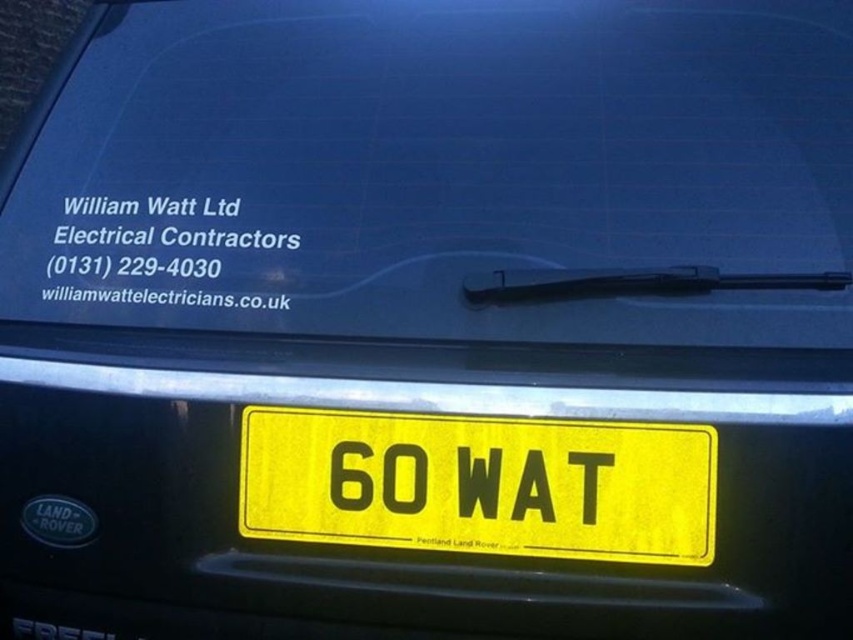
Between transparent glass windshield at center and white paper text at upper center, which one appears on the right side from the viewer's perspective?

transparent glass windshield at center

Can you confirm if transparent glass windshield at center is taller than white paper text at upper center?

Yes.

Measure the distance between transparent glass windshield at center and camera.

transparent glass windshield at center and camera are 5.46 feet apart.

Find the location of `transparent glass windshield at center`. transparent glass windshield at center is located at coordinates (444, 170).

Is yellow matte license plate at center to the right of transparent rubber wiper at upper center from the viewer's perspective?

No, yellow matte license plate at center is not to the right of transparent rubber wiper at upper center.

Can you confirm if yellow matte license plate at center is taller than transparent rubber wiper at upper center?

Indeed, yellow matte license plate at center has a greater height compared to transparent rubber wiper at upper center.

Is point (405, 429) closer to camera compared to point (844, 282)?

That is True.

Where is `yellow matte license plate at center`? The height and width of the screenshot is (640, 853). yellow matte license plate at center is located at coordinates (480, 484).

Consider the image. Can you confirm if yellow matte license plate at center is bigger than white paper text at upper center?

Correct, yellow matte license plate at center is larger in size than white paper text at upper center.

Between yellow matte license plate at center and white paper text at upper center, which one is positioned higher?

white paper text at upper center is above.

Between point (640, 474) and point (276, 298), which one is positioned in front?

Point (640, 474) is in front.

At what (x,y) coordinates should I click in order to perform the action: click on yellow matte license plate at center. Please return your answer as a coordinate pair (x, y). The width and height of the screenshot is (853, 640). Looking at the image, I should click on (480, 484).